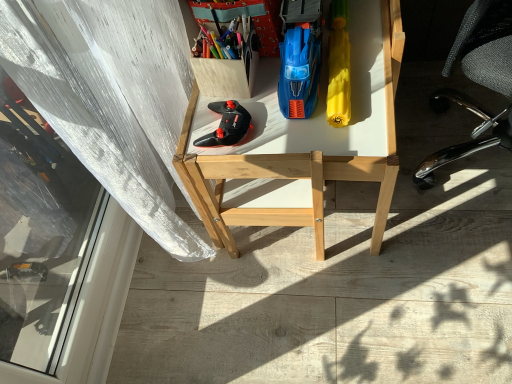
At what (x,y) coordinates should I click in order to perform the action: click on vacant space in front of wooden desk at center. Please return your answer as a coordinate pair (x, y). Looking at the image, I should click on (351, 301).